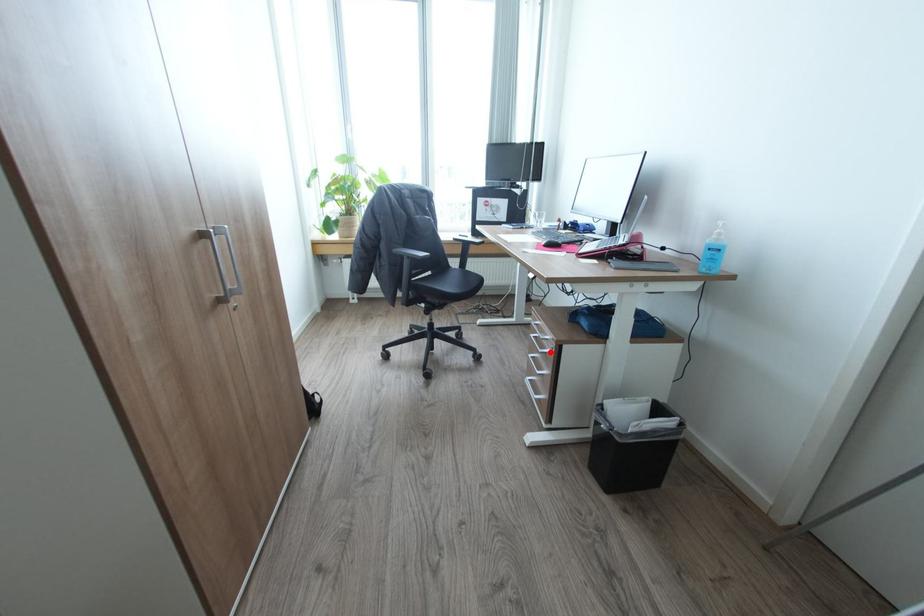
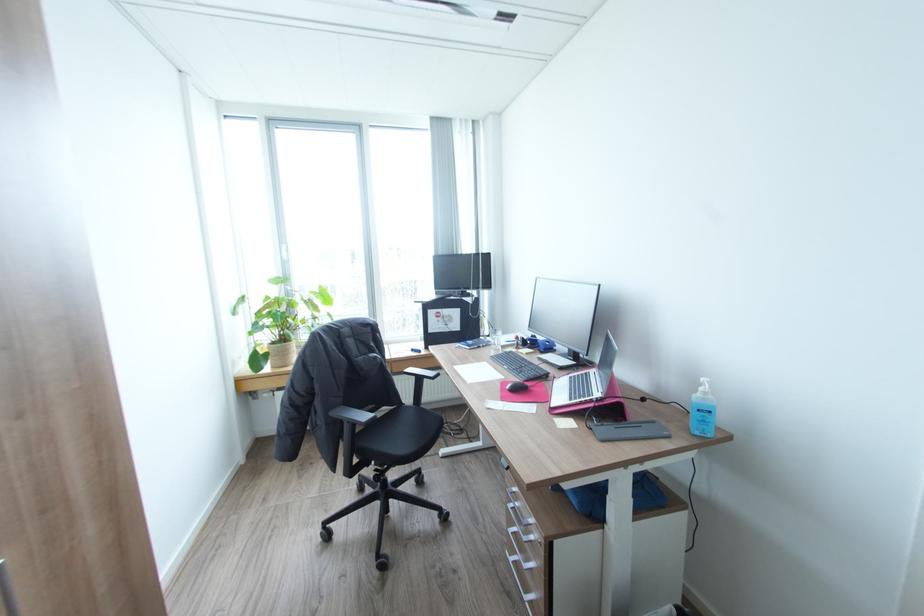
Question: I am providing you with two images of the same scene from different viewpoints. Given a red point in image1, look at the same physical point in image2. Is it:

Choices:
 (A) Closer to the viewpoint
 (B) Farther from the viewpoint

Answer: (B)